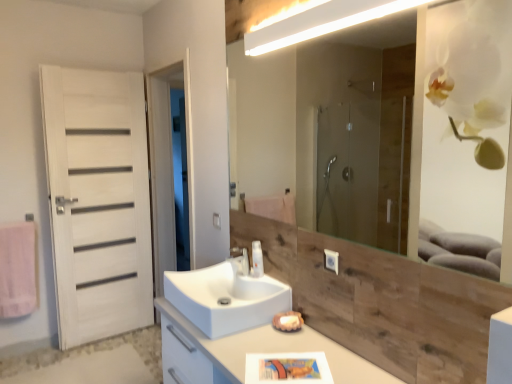
Locate an element on the screen. This screenshot has height=384, width=512. free spot below white wood door at left (from a real-world perspective) is located at coordinates (106, 335).